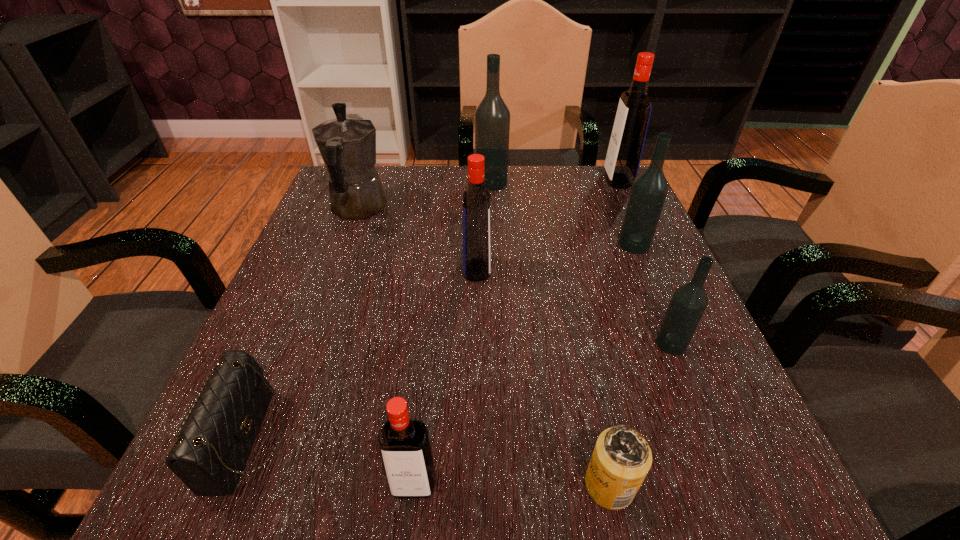
Locate an element on the screen. The width and height of the screenshot is (960, 540). free space that satisfies the following two spatial constraints: 1. on the front and back of the fifth nearest object; 2. on the left side of the beer can is located at coordinates point(475,485).

Image resolution: width=960 pixels, height=540 pixels. Find the location of `free space that satisfies the following two spatial constraints: 1. on the front and back of the rightmost red vodka; 2. on the front side of the sixth object from left to right`. free space that satisfies the following two spatial constraints: 1. on the front and back of the rightmost red vodka; 2. on the front side of the sixth object from left to right is located at coordinates (757, 485).

Find the location of a particular element. The height and width of the screenshot is (540, 960). vacant space that satisfies the following two spatial constraints: 1. on the pouring side of the leftmost black vodka; 2. on the left side of the coffeepot is located at coordinates (368, 183).

This screenshot has height=540, width=960. Identify the location of vacant position in the image that satisfies the following two spatial constraints: 1. on the front and back of the second smallest red vodka; 2. on the front and back of the nearest red vodka. [475, 485].

Locate an element on the screen. vacant space that satisfies the following two spatial constraints: 1. on the front flap of the beer can; 2. on the right side of the clutch bag is located at coordinates (228, 485).

Image resolution: width=960 pixels, height=540 pixels. What are the coordinates of `vacant space that satisfies the following two spatial constraints: 1. on the pouring side of the coffeepot; 2. on the right side of the leftmost black vodka` in the screenshot? It's located at (368, 183).

Locate an element on the screen. The height and width of the screenshot is (540, 960). vacant point that satisfies the following two spatial constraints: 1. on the back side of the fourth object from right to left; 2. on the front flap of the clutch bag is located at coordinates (600, 440).